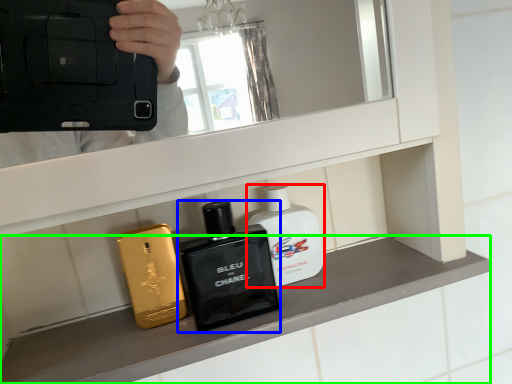
Question: Which is farther away from perfume (highlighted by a red box)? toiletry (highlighted by a blue box) or mantle (highlighted by a green box)?

Choices:
 (A) toiletry
 (B) mantle

Answer: (B)